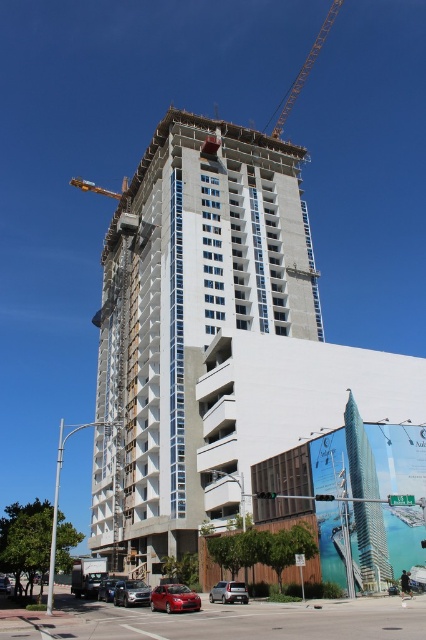
Does metallic silver sedan at lower left come in front of shiny black sedan at lower left?

Yes.

Is metallic silver sedan at lower left to the left of shiny black sedan at lower left from the viewer's perspective?

No, metallic silver sedan at lower left is not to the left of shiny black sedan at lower left.

The width and height of the screenshot is (426, 640). Find the location of `metallic silver sedan at lower left`. metallic silver sedan at lower left is located at coordinates (131, 593).

Does metallic yellow crane at upper center appear over yellow metallic crane at upper center?

Yes, metallic yellow crane at upper center is above yellow metallic crane at upper center.

Which is more to the right, metallic yellow crane at upper center or yellow metallic crane at upper center?

Positioned to the right is metallic yellow crane at upper center.

What do you see at coordinates (305, 67) in the screenshot? I see `metallic yellow crane at upper center` at bounding box center [305, 67].

Find the location of a particular element. The width and height of the screenshot is (426, 640). metallic yellow crane at upper center is located at coordinates (305, 67).

Who is positioned more to the left, concrete at center or metallic yellow crane at upper center?

concrete at center

Between point (226, 186) and point (336, 4), which one is positioned in front?

Point (226, 186)

At what (x,y) coordinates should I click in order to perform the action: click on concrete at center. Please return your answer as a coordinate pair (x, y). The image size is (426, 640). Looking at the image, I should click on (187, 317).